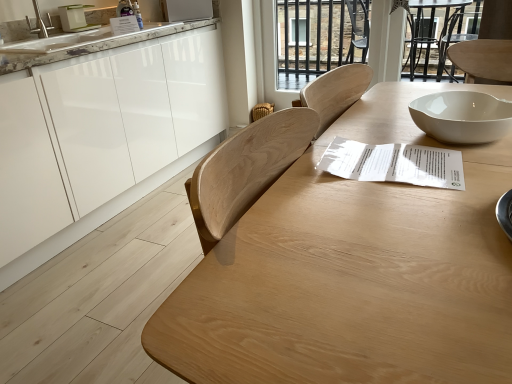
Identify the location of free location to the left of white paper at center. (298, 187).